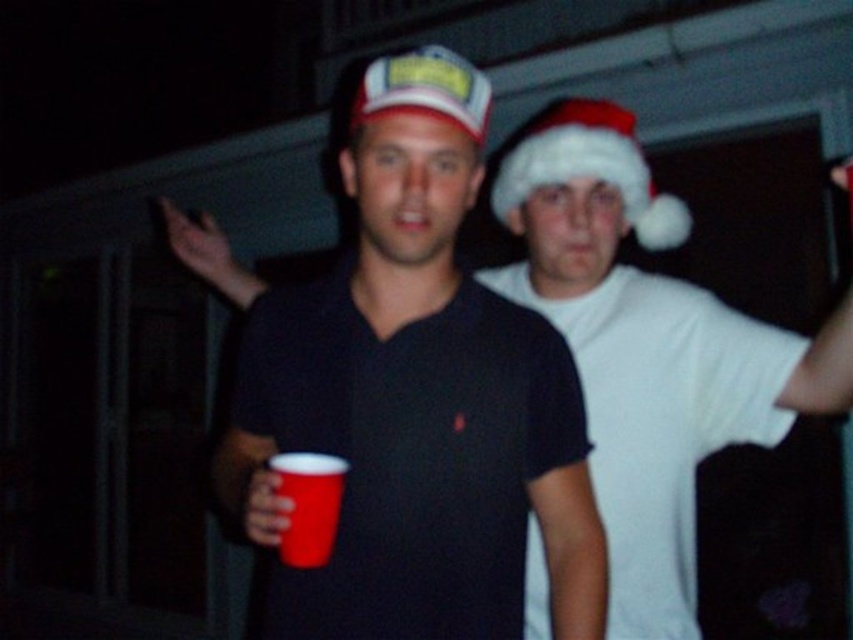
You are at a nighttime event and see the matte plastic cup at center. If you want to grab it without moving your feet, can you reach it?

The matte plastic cup at center is 3.33 feet from viewer, so if you can reach 3.33 feet, you can grab it. Otherwise, you might need to move closer.

You are a photographer trying to capture the white fluffy santa hat at upper right in the center of your camera frame. Given the coordinates of the hat at point 0.263, 0.692, what direction should you move your camera to center it?

To center the white fluffy santa hat at upper right, move the camera to the left and down since the hat is located at coordinates [589,168]. The x coordinate 0.263 is left of center, and the y coordinate 0.692 is below the top, so moving down would center it.